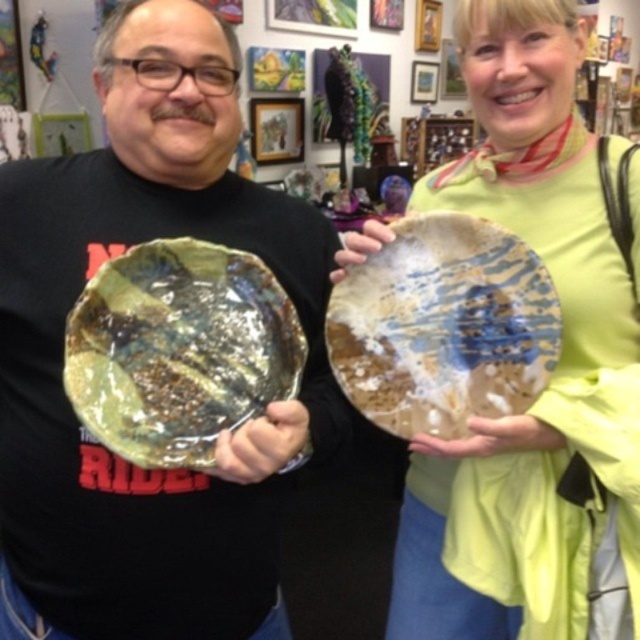
Question: Which point is closer to the camera?

Choices:
 (A) (84, 636)
 (B) (602, 209)

Answer: (A)

Question: Does metallic gold plate at center appear over matte ceramic plate at center?

Choices:
 (A) no
 (B) yes

Answer: (B)

Question: Which is farther from the matte ceramic plate at center?

Choices:
 (A) metallic gold plate at center
 (B) shiny metallic plate at center

Answer: (B)

Question: Observing the image, what is the correct spatial positioning of shiny metallic plate at center in reference to translucent amber plate at center?

Choices:
 (A) left
 (B) right

Answer: (A)

Question: Which object is positioned closest to the shiny metallic plate at center?

Choices:
 (A) matte ceramic plate at center
 (B) metallic gold plate at center
 (C) translucent amber plate at center

Answer: (B)

Question: Does metallic gold plate at center have a smaller size compared to translucent amber plate at center?

Choices:
 (A) no
 (B) yes

Answer: (A)